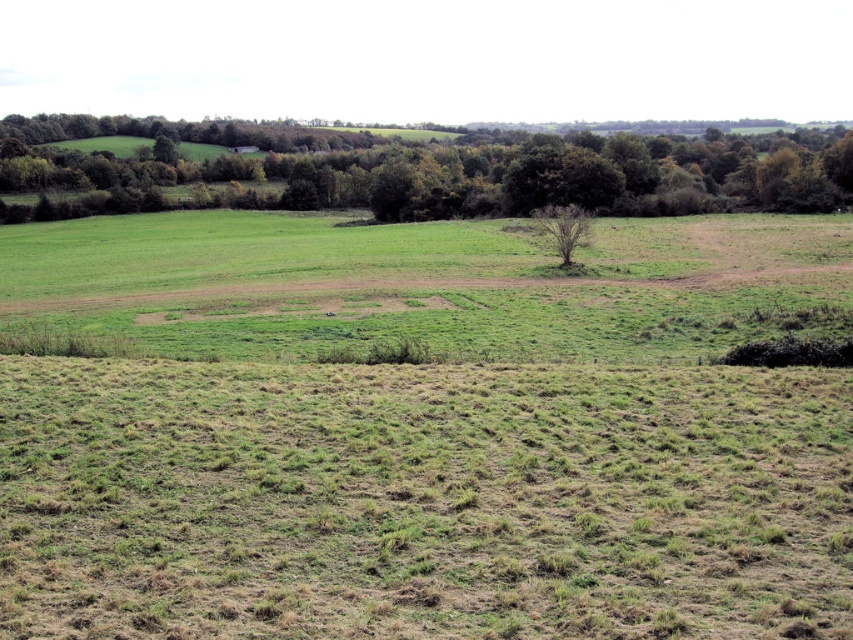
You are a bird looking for a nesting spot. You see the green leafy tree at upper center and the bare brown tree at center. Which tree is located above the other?

The green leafy tree at upper center is positioned over the bare brown tree at center.

You are a hiker standing in the middle of the field and see the green leafy tree at upper center and the bare brown tree at center. Which tree is located to the right of the other?

The green leafy tree at upper center is positioned to the right of the bare brown tree at center.

You are standing in the rural landscape and want to walk from the point at coordinates point (56, 204) to the point at coordinates point (537, 214). Which direction should you face to move towards the destination?

You should face towards the background direction because point (56, 204) is closer to the camera than point (537, 214), so moving towards the background will take you towards the destination.